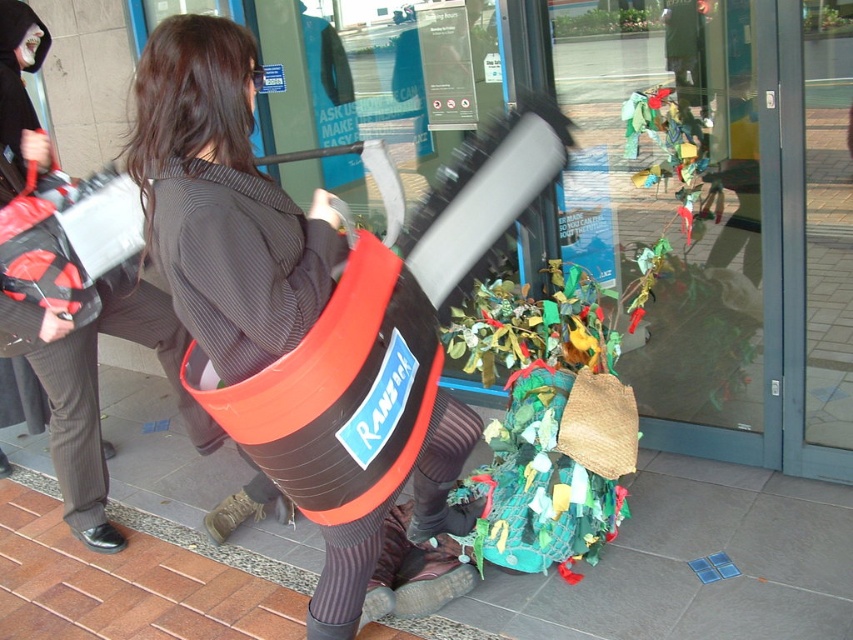
Who is positioned more to the left, transparent glass door at center or matte black bag at center?

Positioned to the left is matte black bag at center.

From the picture: Can you confirm if transparent glass door at center is thinner than matte black bag at center?

No, transparent glass door at center is not thinner than matte black bag at center.

Locate an element on the screen. transparent glass door at center is located at coordinates tap(727, 220).

Where is `transparent glass door at center`? The width and height of the screenshot is (853, 640). transparent glass door at center is located at coordinates (727, 220).